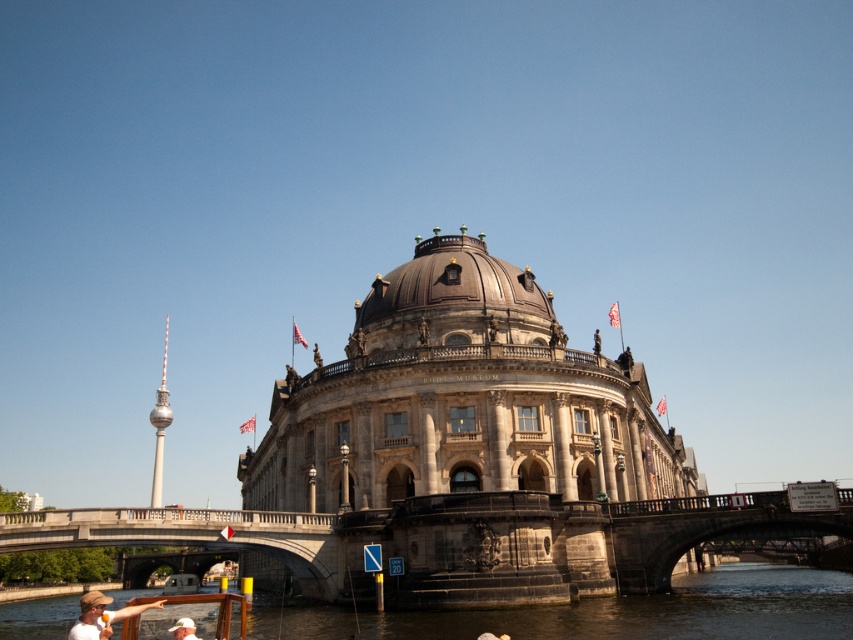
You are standing at the point marked by the coordinates point (453, 284) in the image. What object are you directly facing?

The point (453, 284) indicates the brown polished dome at center, so you are directly facing the brown polished dome at center.

You are standing at the center of the stone bridge at lower center. Looking towards the grand museum with its central dome, which direction should you turn to face the river?

Since the stone bridge at lower center spans the river, turning to face the river would mean looking away from the museum. However, the question asks for the direction to face the river while facing the museum. Wait, perhaps the bridge is between the museum and the river? The scene description says the museum is situated by the river, so the river is adjacent to the museum. If the bridge is in the foreground spanning the river, then the museum is on one side of the river, and the bridge connects to the city